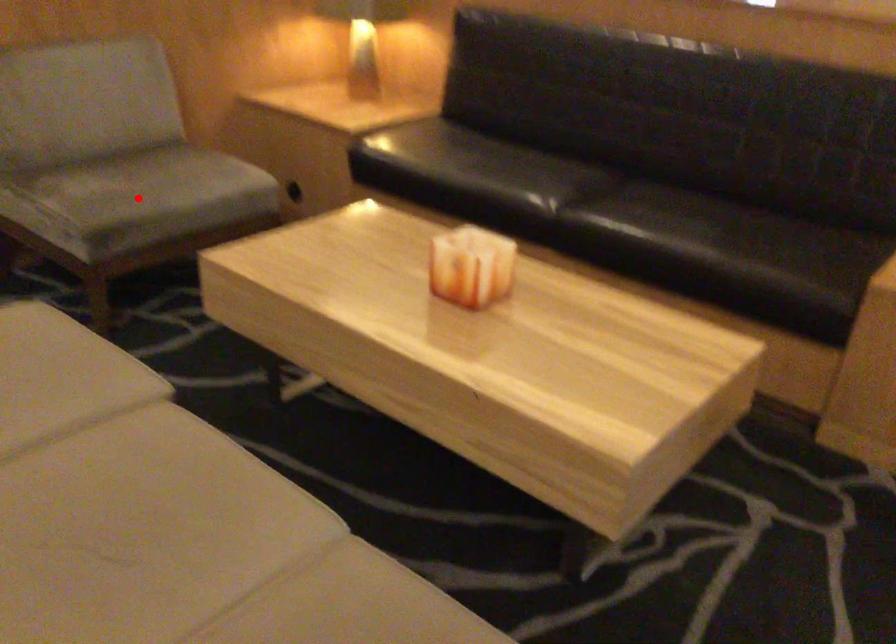
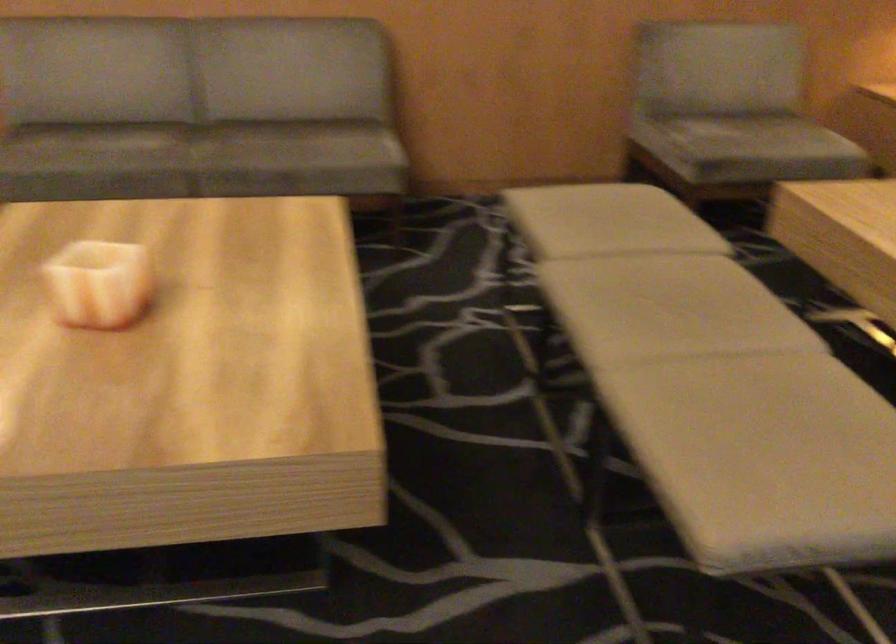
Question: A red point is marked in image1. In image2, is the corresponding 3D point closer to the camera or farther? Reply with the corresponding letter.

Choices:
 (A) The corresponding 3D point is closer.
 (B) The corresponding 3D point is farther.

Answer: (B)